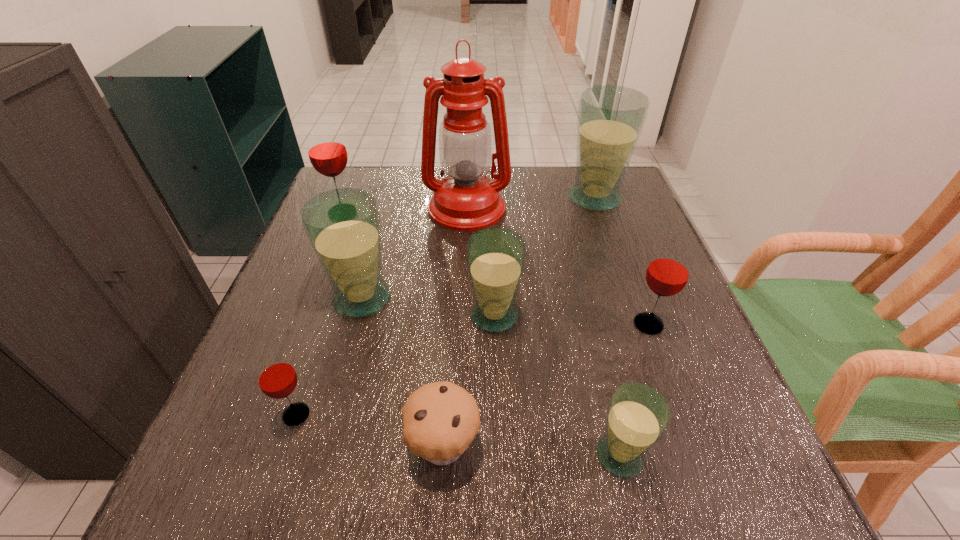
At what (x,y) coordinates should I click in order to perform the action: click on oil lamp. Please return your answer as a coordinate pair (x, y). Looking at the image, I should click on (466, 200).

Locate an element on the screen. The image size is (960, 540). the biggest blue glass is located at coordinates (611, 118).

The image size is (960, 540). I want to click on the second tallest object, so click(x=611, y=118).

Identify the location of the biggest red glass. (327, 152).

You are a GUI agent. You are given a task and a screenshot of the screen. Output one action in this format:
    pyautogui.click(x=<x>, y=<y>)
    Task: Click on the leftmost blue glass
    The height and width of the screenshot is (540, 960).
    Given the screenshot: What is the action you would take?
    342,225

Locate an element on the screen. Image resolution: width=960 pixels, height=540 pixels. the rightmost red glass is located at coordinates (668, 272).

You are a GUI agent. You are given a task and a screenshot of the screen. Output one action in this format:
    pyautogui.click(x=<x>, y=<y>)
    Task: Click on the second smallest red glass
    This screenshot has height=540, width=960.
    Given the screenshot: What is the action you would take?
    pyautogui.click(x=668, y=272)

Identify the location of the second blue glass from left to right. This screenshot has width=960, height=540. (496, 257).

Locate an element on the screen. the second smallest blue glass is located at coordinates (496, 257).

In order to click on the second nearest glass in this screenshot , I will do `click(277, 378)`.